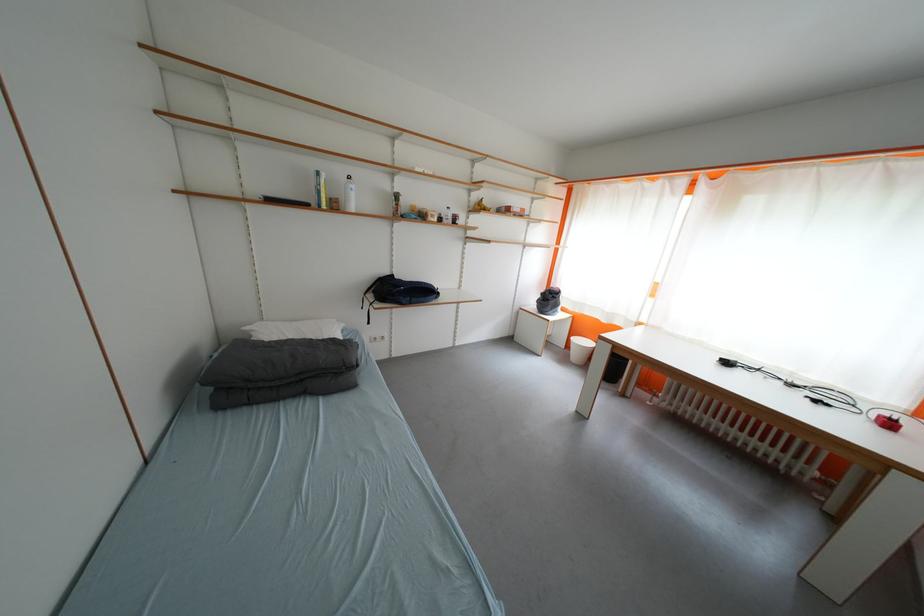
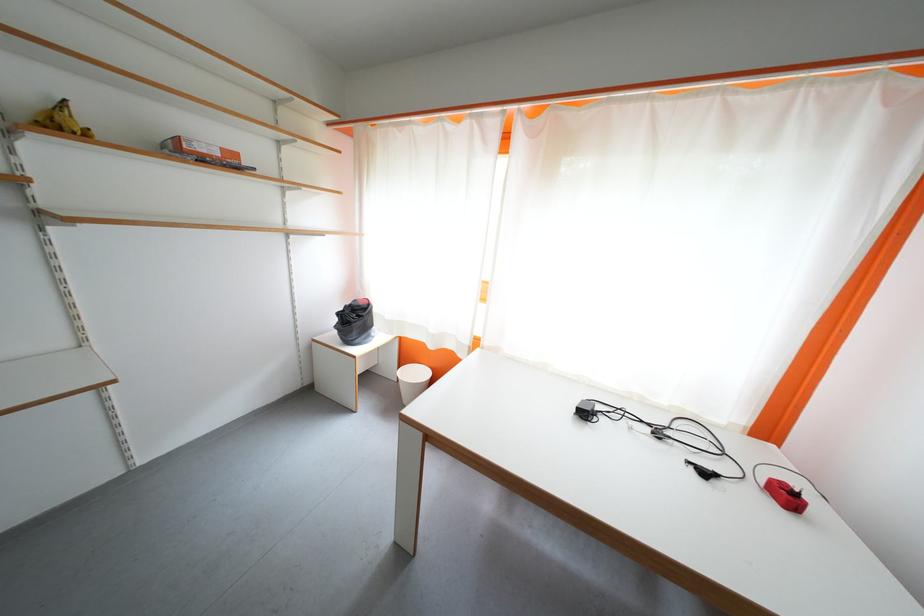
Locate, in the second image, the point that corresponds to point (551, 297) in the first image.

(347, 317)